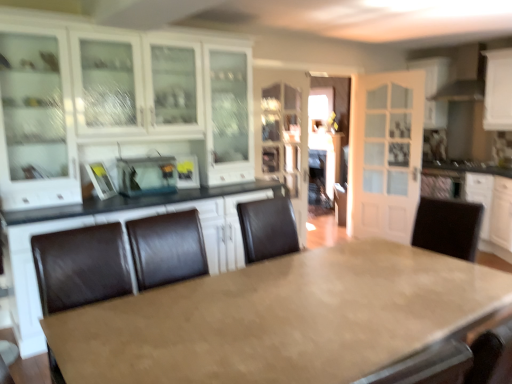
Find the location of `free space above white glass door at upper right (from a real-world perspective)`. free space above white glass door at upper right (from a real-world perspective) is located at coordinates (390, 75).